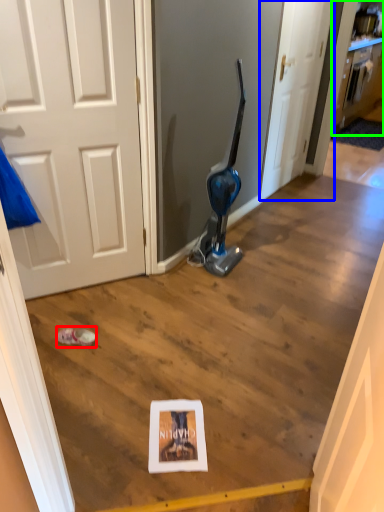
Question: Which object is positioned farthest from footwear (highlighted by a red box)? Select from door (highlighted by a blue box) and cabinetry (highlighted by a green box).

Choices:
 (A) door
 (B) cabinetry

Answer: (B)